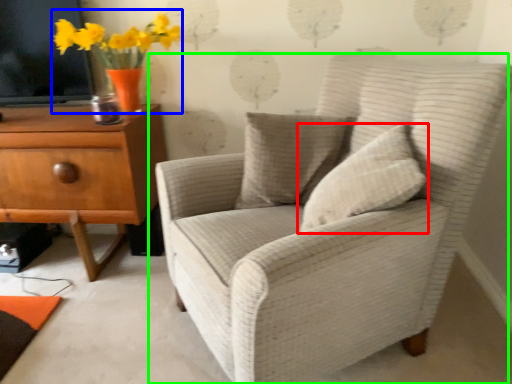
Question: Estimate the real-world distances between objects in this image. Which object is closer to pillow (highlighted by a red box), floral arrangement (highlighted by a blue box) or chair (highlighted by a green box)?

Choices:
 (A) floral arrangement
 (B) chair

Answer: (B)